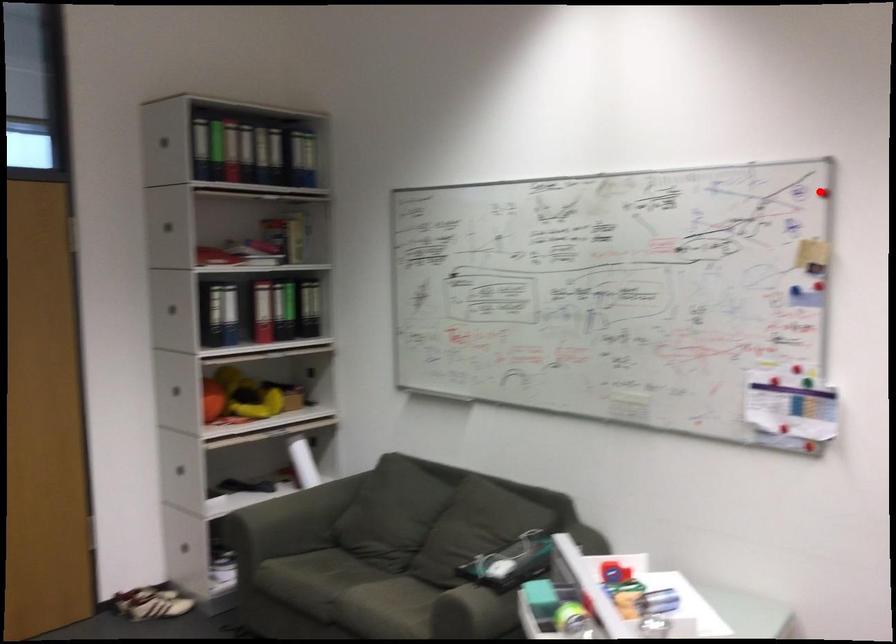
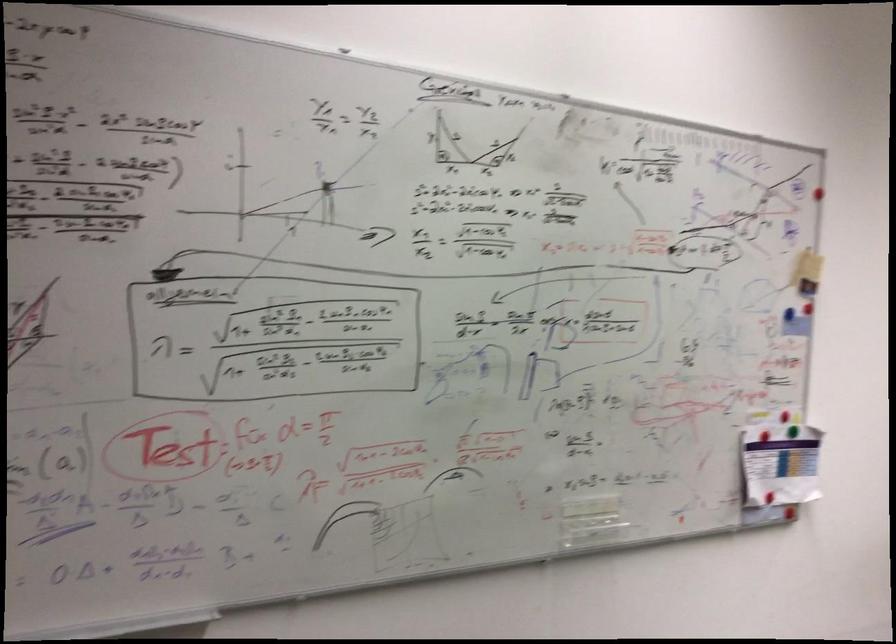
Question: I am providing you with two images of the same scene from different viewpoints. A red point is shown in image1. For the corresponding object point in image2, is it positioned nearer or farther from the camera?

Choices:
 (A) Nearer
 (B) Farther

Answer: (A)